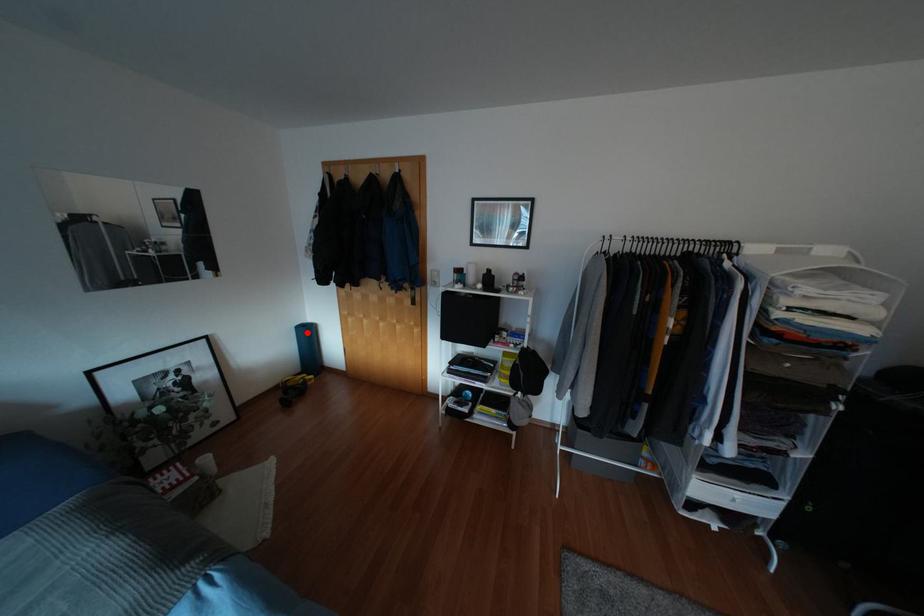
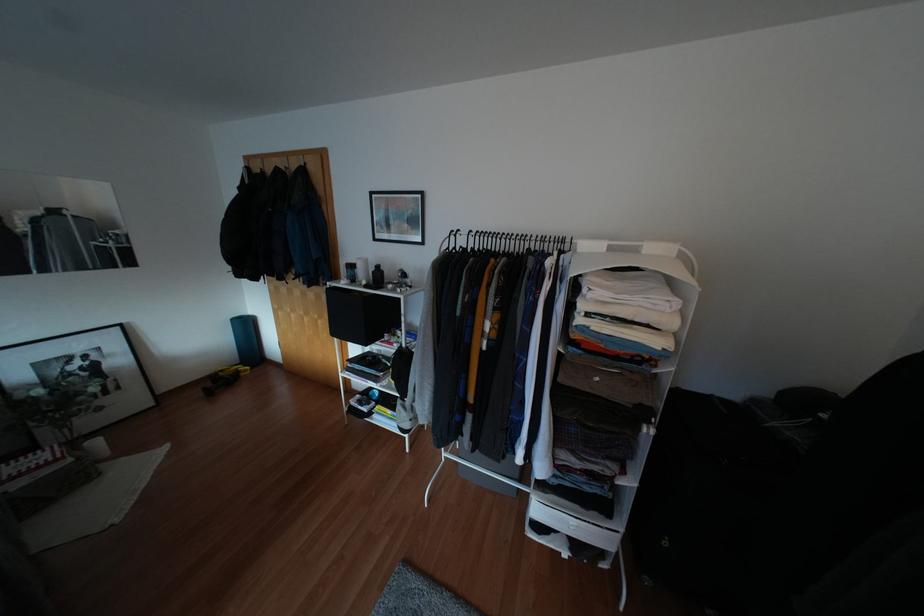
Locate, in the second image, the point that corresponds to the highlighted location in the first image.

(246, 325)